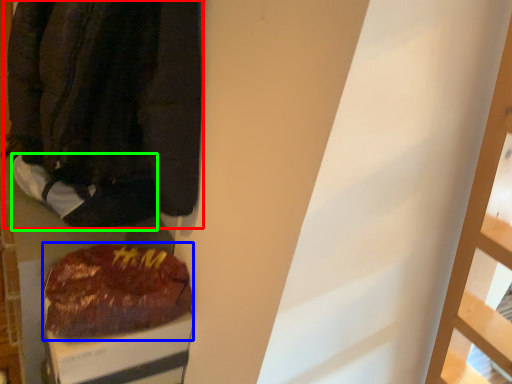
Question: Which object is positioned farthest from jacket (highlighted by a red box)? Select from food (highlighted by a blue box) and footwear (highlighted by a green box).

Choices:
 (A) food
 (B) footwear

Answer: (A)